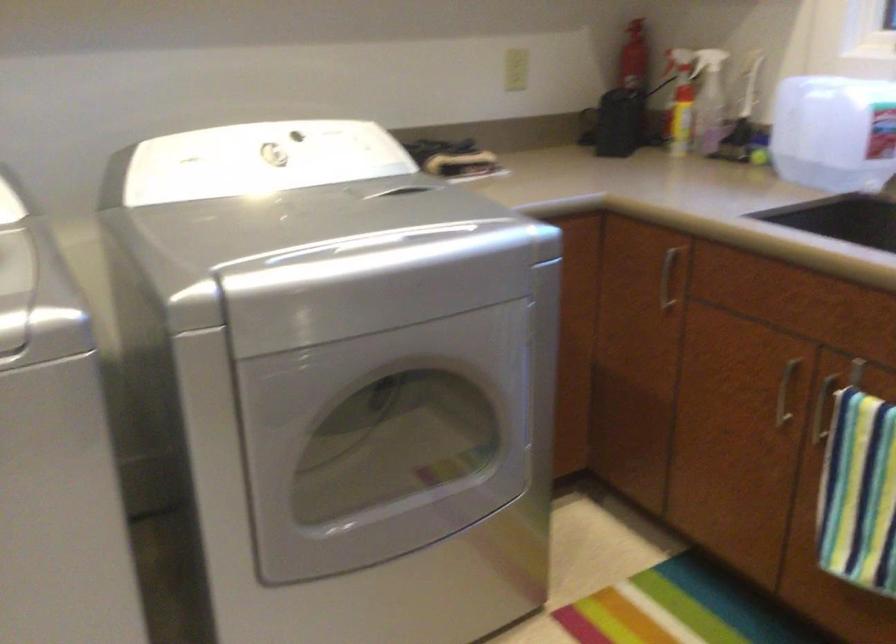
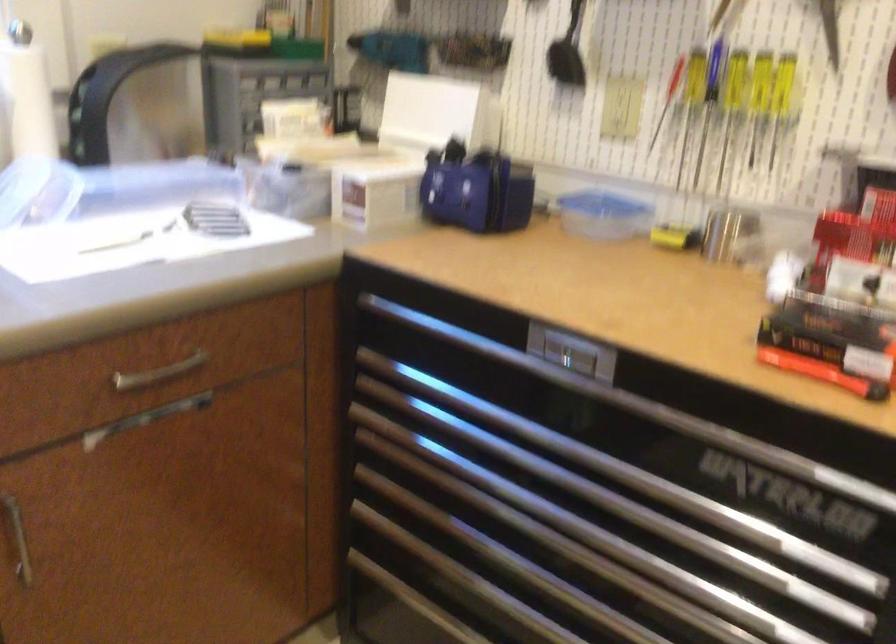
Consider the image. How did the camera likely rotate?

The rotation direction of the camera is right-down.